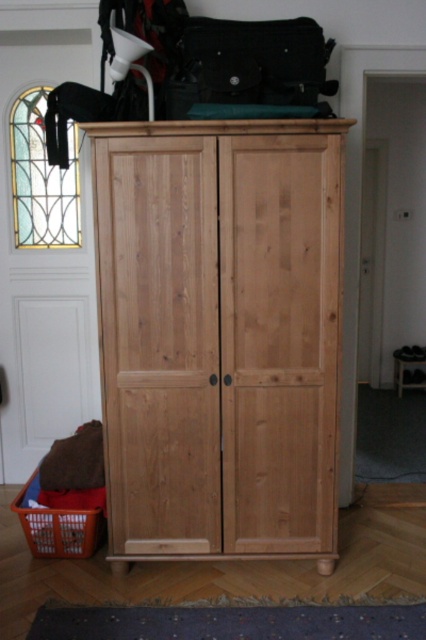
Looking at this image, does matte black bag at top come in front of orange plastic basket at lower left?

Yes, it is.

Who is more distant from viewer, [322,45] or [75,509]?

Point [75,509]

Where is `matte black bag at top`? This screenshot has width=426, height=640. matte black bag at top is located at coordinates (250, 65).

The width and height of the screenshot is (426, 640). What are the coordinates of `matte black bag at top` in the screenshot? It's located at (250, 65).

Does natural wood wardrobe at center have a greater height compared to matte black bag at top?

Yes, natural wood wardrobe at center is taller than matte black bag at top.

Locate an element on the screen. The width and height of the screenshot is (426, 640). natural wood wardrobe at center is located at coordinates (219, 336).

You are a GUI agent. You are given a task and a screenshot of the screen. Output one action in this format:
    pyautogui.click(x=<x>, y=<y>)
    Task: Click on the natural wood wardrobe at center
    
    Given the screenshot: What is the action you would take?
    pyautogui.click(x=219, y=336)

Does natural wood wardrobe at center have a larger size compared to orange plastic basket at lower left?

Yes.

Is natural wood wardrobe at center above orange plastic basket at lower left?

Yes, natural wood wardrobe at center is above orange plastic basket at lower left.

At what (x,y) coordinates should I click in order to perform the action: click on natural wood wardrobe at center. Please return your answer as a coordinate pair (x, y). Looking at the image, I should click on 219,336.

What are the coordinates of `natural wood wardrobe at center` in the screenshot? It's located at (219, 336).